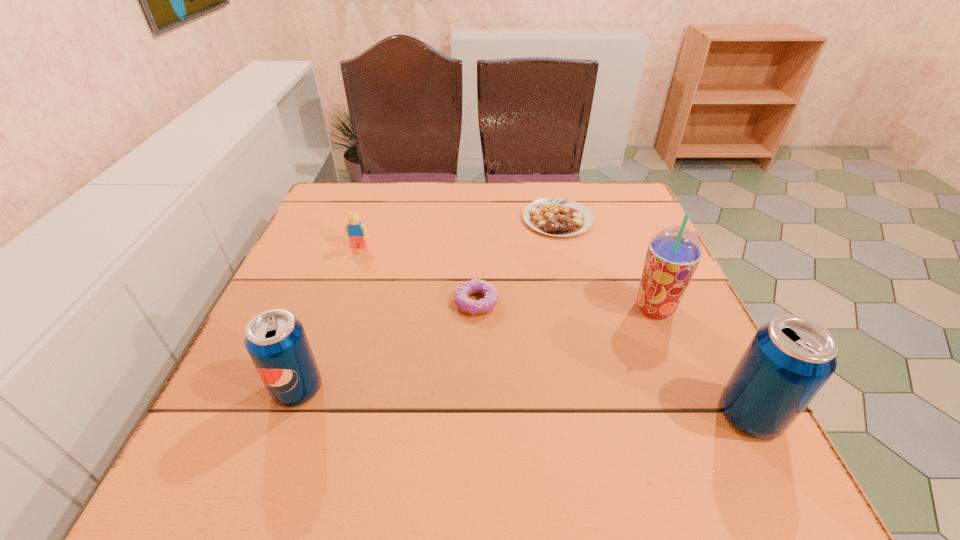
You are a GUI agent. You are given a task and a screenshot of the screen. Output one action in this format:
    pyautogui.click(x=<x>, y=<y>)
    Task: Click on the free space between the left pop soda and the second tallest object
    The height and width of the screenshot is (540, 960).
    Given the screenshot: What is the action you would take?
    pyautogui.click(x=524, y=401)

This screenshot has width=960, height=540. In order to click on object that is the nearest to the second farthest object in this screenshot , I will do `click(475, 286)`.

Find the location of a particular element. This screenshot has width=960, height=540. object that is the third closest to the doughnut is located at coordinates (276, 341).

You are a GUI agent. You are given a task and a screenshot of the screen. Output one action in this format:
    pyautogui.click(x=<x>, y=<y>)
    Task: Click on the free space that satisfies the following two spatial constraints: 1. on the back side of the third object from left to right; 2. on the left side of the steak
    The image size is (960, 540).
    Given the screenshot: What is the action you would take?
    pyautogui.click(x=477, y=219)

You are a GUI agent. You are given a task and a screenshot of the screen. Output one action in this format:
    pyautogui.click(x=<x>, y=<y>)
    Task: Click on the vacant region that satisfies the following two spatial constraints: 1. on the front-facing side of the taller pop soda; 2. on the right side of the Lego
    The width and height of the screenshot is (960, 540).
    Given the screenshot: What is the action you would take?
    [301, 414]

Locate an element on the screen. This screenshot has height=540, width=960. vacant space that satisfies the following two spatial constraints: 1. on the front-facing side of the smoothie; 2. on the left side of the Lego is located at coordinates (338, 308).

Image resolution: width=960 pixels, height=540 pixels. Identify the location of free space that satisfies the following two spatial constraints: 1. on the front-facing side of the fifth shortest object; 2. on the right side of the Lego. (301, 414).

Where is `vacant area in the image that satisfies the following two spatial constraints: 1. on the back side of the left pop soda; 2. on the left side of the doughnut`? The image size is (960, 540). vacant area in the image that satisfies the following two spatial constraints: 1. on the back side of the left pop soda; 2. on the left side of the doughnut is located at coordinates (329, 303).

Identify the location of free point that satisfies the following two spatial constraints: 1. on the front-facing side of the fourth tallest object; 2. on the left side of the third object from left to right. (340, 303).